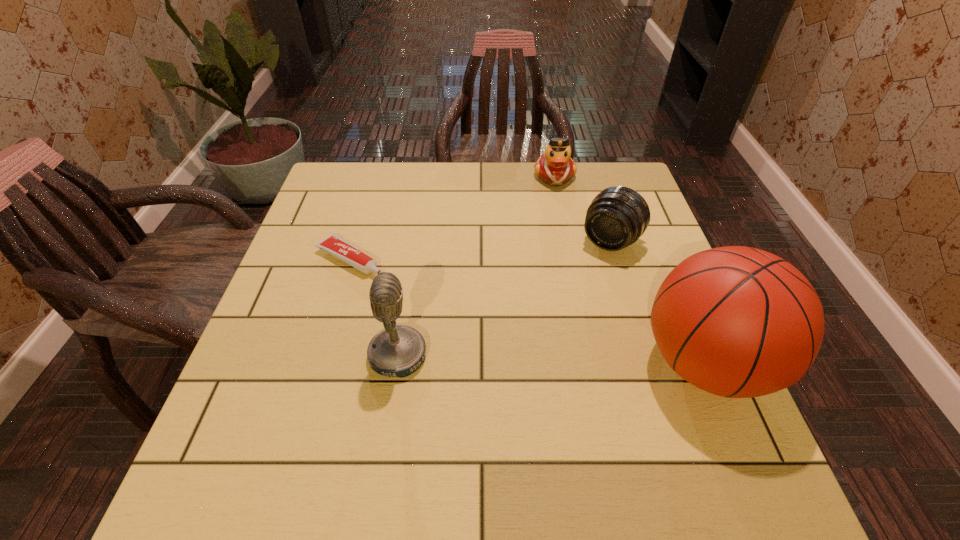
At what (x,y) coordinates should I click in order to perform the action: click on object that is at the left edge. Please return your answer as a coordinate pair (x, y). Looking at the image, I should click on (333, 244).

This screenshot has width=960, height=540. I want to click on basketball that is positioned at the right edge, so click(739, 322).

Where is `telephoto lens at the right edge`? The height and width of the screenshot is (540, 960). telephoto lens at the right edge is located at coordinates (616, 218).

The width and height of the screenshot is (960, 540). Find the location of `object positioned at the near right corner`. object positioned at the near right corner is located at coordinates (739, 322).

Image resolution: width=960 pixels, height=540 pixels. I want to click on vacant space at the far edge of the desktop, so click(x=462, y=167).

Image resolution: width=960 pixels, height=540 pixels. Find the location of `free space at the near edge`. free space at the near edge is located at coordinates (438, 407).

Where is `vacant space at the left edge of the desktop`? The image size is (960, 540). vacant space at the left edge of the desktop is located at coordinates (270, 369).

This screenshot has width=960, height=540. In the image, there is a desktop. In order to click on free space at the right edge in this screenshot , I will do `click(625, 274)`.

Identify the location of vacant area at the far left corner. The width and height of the screenshot is (960, 540). (329, 207).

Locate an element on the screen. Image resolution: width=960 pixels, height=540 pixels. vacant space at the near left corner of the desktop is located at coordinates (301, 421).